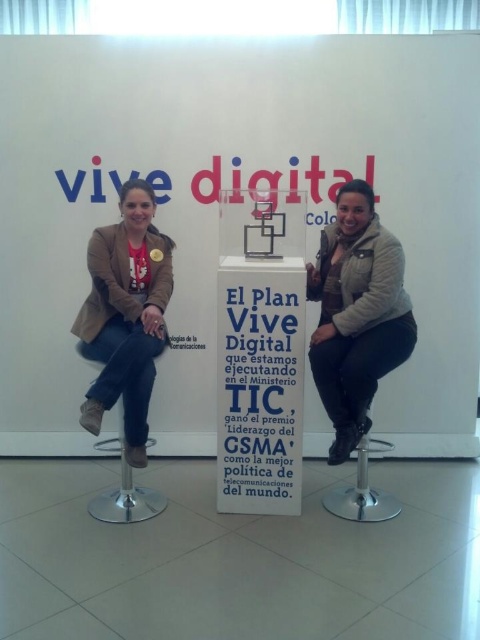
You are an interior designer assessing the layout of this space. You notice the matte beige jacket at center and the metallic silver bar stool at lower center. Which object is closer to the viewer?

The matte beige jacket at center is closer to the viewer because it is in front of the metallic silver bar stool at lower center.

What object is located at the coordinates point [124,316]?

The point [124,316] is on the matte beige jacket at left.